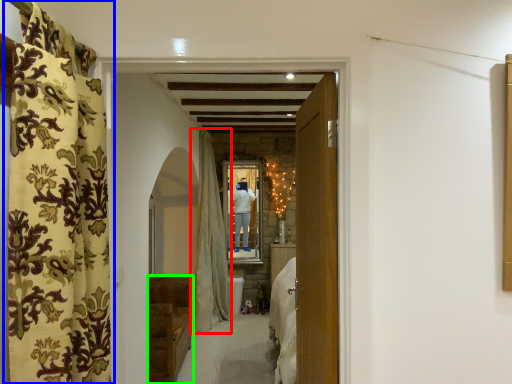
Question: Estimate the real-world distances between objects in this image. Which object is closer to curtain (highlighted by a red box), curtain (highlighted by a blue box) or furniture (highlighted by a green box)?

Choices:
 (A) curtain
 (B) furniture

Answer: (B)